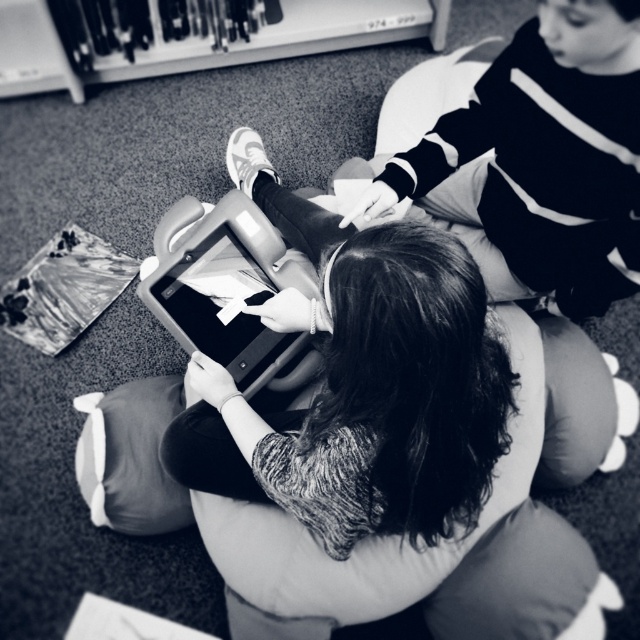
You are trying to determine which of the two points, point (621, 147) or point (244, 278), is nearer to you in the image. Based on the scene, which one would you choose?

Point (621, 147) is closer to the viewer than point (244, 278), so you should choose point (621, 147).

You are designing a storage box for the smooth black sweater at upper right and the matte plastic tablet at center. The tablet requires a compartment that is exactly the same size as itself. Will the compartment for the tablet be smaller than the sweater compartment?

The smooth black sweater at upper right is bigger than the matte plastic tablet at center, so the compartment for the matte plastic tablet at center will be smaller than the sweater compartment.